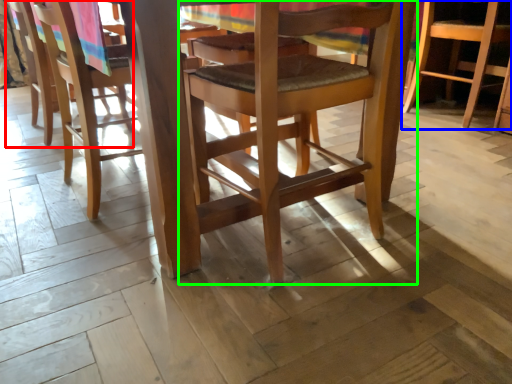
Question: Estimate the real-world distances between objects in this image. Which object is closer to chair (highlighted by a red box), chair (highlighted by a blue box) or chair (highlighted by a green box)?

Choices:
 (A) chair
 (B) chair

Answer: (B)